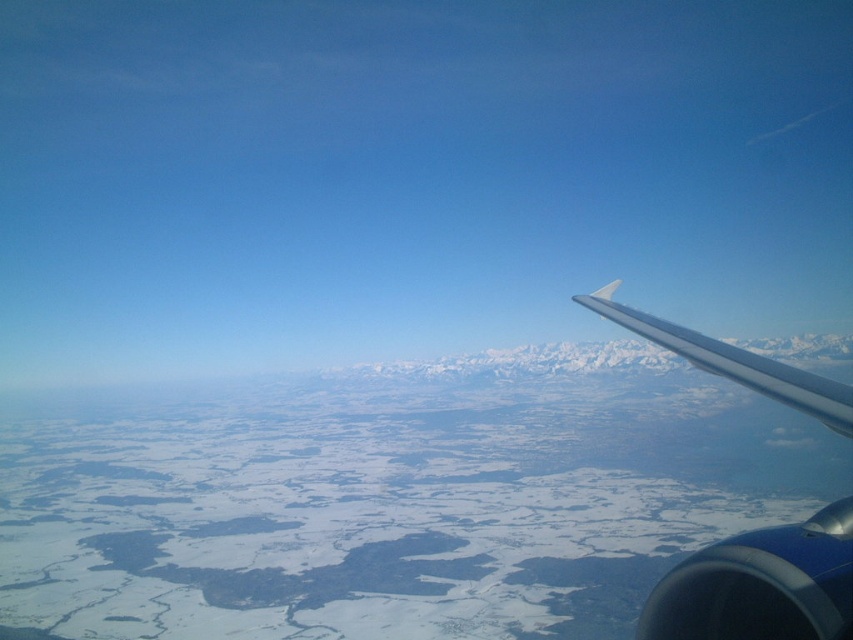
You are a passenger on an airplane and want to take a photo of the metallic silver wing at right and the white glossy wing at upper right through the window. Which wing will appear smaller in your photo?

The metallic silver wing at right will appear smaller in the photo because it occupies less space than the white glossy wing at upper right according to the description.

In the scene shown: You are a passenger sitting at seat 20A in an airplane and looking out the window. You notice a point marked at coordinates [759,586] on your window. What object is located at that point?

The metallic silver wing at right is located at point [759,586].

You are seated in an airplane seat and looking out the window. There is a point marked at coordinates (730, 355) in the window. The airplane window is 3 feet wide. Can you reach that point with your hand if you lean forward as much as possible, considering your arm can extend 2 feet from the seat?

The point at (730, 355) is 21.03 feet from the camera. Since your arm can only extend 2 feet from the seat, you cannot reach the point as it is much farther away.